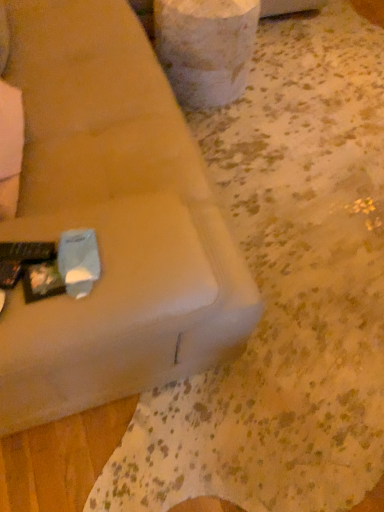
Describe the element at coordinates (112, 220) in the screenshot. This screenshot has width=384, height=512. I see `suede-like beige couch at lower left` at that location.

The width and height of the screenshot is (384, 512). I want to click on suede-like beige couch at lower left, so click(112, 220).

What are the coordinates of `suede-like beige couch at lower left` in the screenshot? It's located at (112, 220).